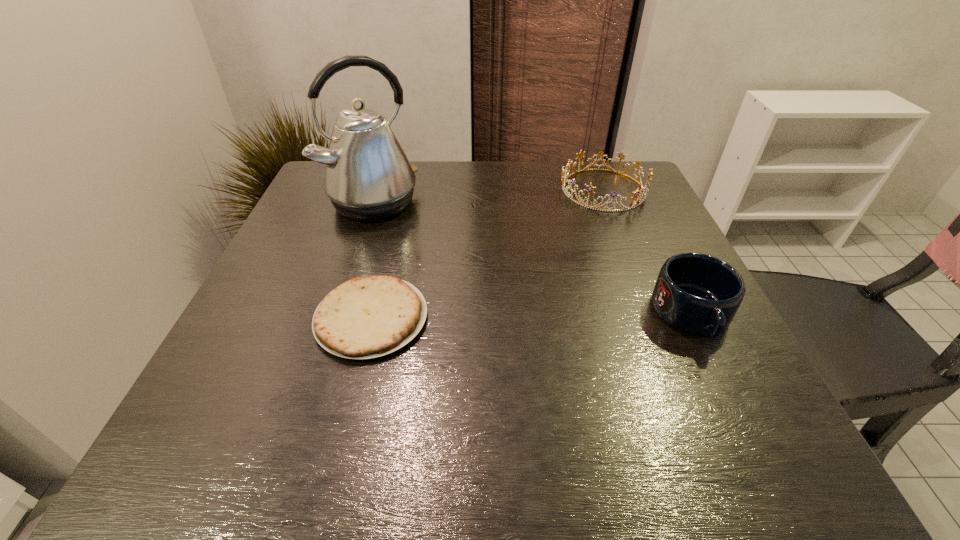
Identify the location of vacant space located from the spout of the kettle. The width and height of the screenshot is (960, 540). (445, 266).

Find the location of `vacant position located 0.130m from the spout of the kettle`. vacant position located 0.130m from the spout of the kettle is located at coordinates (425, 248).

The height and width of the screenshot is (540, 960). What are the coordinates of `tiara located at the far edge` in the screenshot? It's located at (633, 204).

Identify the location of kettle positioned at the far edge. Image resolution: width=960 pixels, height=540 pixels. (368, 177).

Where is `tortilla situated at the left edge`? tortilla situated at the left edge is located at coordinates (367, 317).

This screenshot has height=540, width=960. I want to click on kettle located at the left edge, so click(368, 177).

This screenshot has height=540, width=960. Find the location of `mug present at the right edge`. mug present at the right edge is located at coordinates (697, 293).

The image size is (960, 540). Identify the location of tiara that is positioned at the right edge. (633, 204).

At what (x,y) coordinates should I click in order to perform the action: click on object situated at the far left corner. Please return your answer as a coordinate pair (x, y). Looking at the image, I should click on (368, 177).

Locate an element on the screen. object that is at the far right corner is located at coordinates (633, 204).